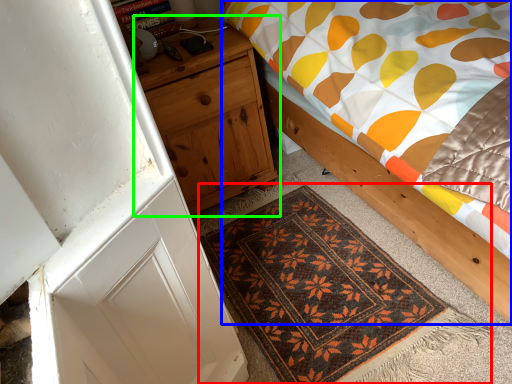
Question: Which object is positioned farthest from mat (highlighted by a red box)? Select from bed (highlighted by a blue box) and nightstand (highlighted by a green box).

Choices:
 (A) bed
 (B) nightstand

Answer: (B)